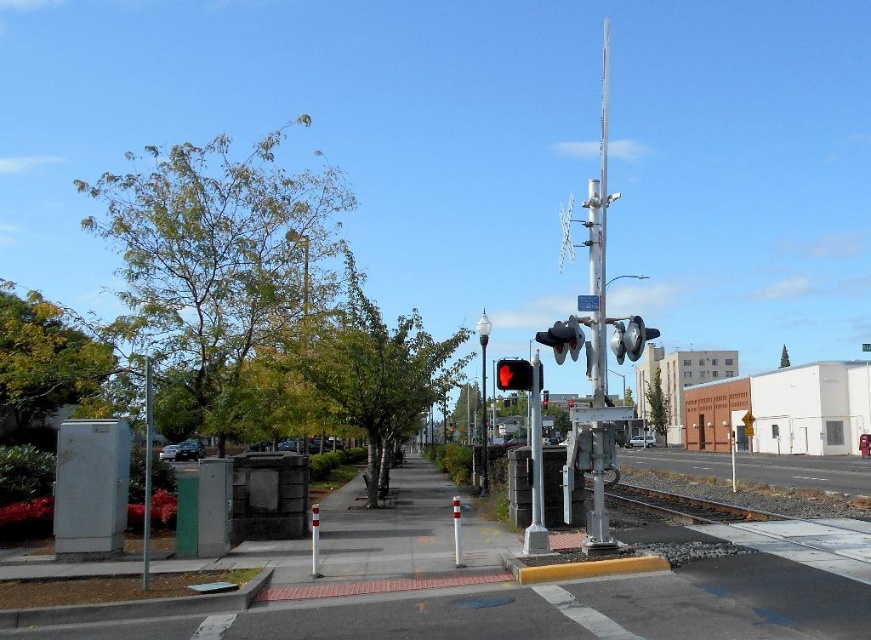
You are a city planner assessing the street layout. The green textured utility pole at left and the red matte traffic light at center are both along the sidewalk. Which object is wider?

The green textured utility pole at left is wider than the red matte traffic light at center because its width surpasses the traffic light.

You are a city planner assessing the railroad crossing. You need to install a new traffic light that must be placed between the silver metallic pole at right and the green textured utility pole at left. Considering their sizes, which pole should the new traffic light be attached to and why?

The new traffic light should be attached to the silver metallic pole at right because it has a larger size compared to the green textured utility pole at left, providing a more stable and visible structure for the traffic light.